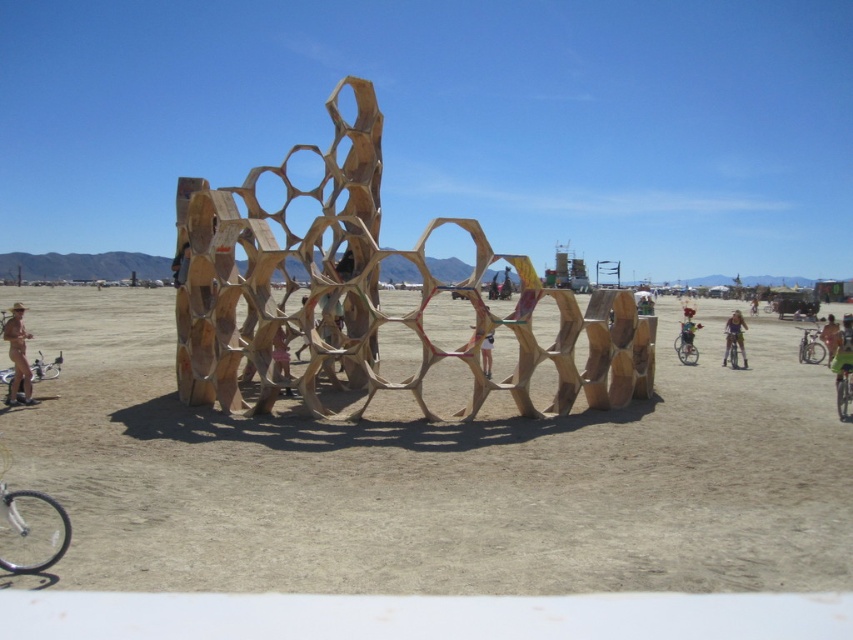
Question: Which object is the closest to the brown textured dirt at center?

Choices:
 (A) metallic silver bicycle at center-right
 (B) white matte wooden sculpture at center

Answer: (B)

Question: Can you confirm if matte gold statue at lower left is wider than green fabric bicycle at center?

Choices:
 (A) no
 (B) yes

Answer: (B)

Question: Among these points, which one is farthest from the camera?

Choices:
 (A) (807, 349)
 (B) (485, 333)
 (C) (824, 339)

Answer: (A)

Question: Is matte gold statue at lower left bigger than silver metallic bicycle at right?

Choices:
 (A) no
 (B) yes

Answer: (A)

Question: Can you confirm if green fabric bicycle at center is thinner than green matte bicycle at center?

Choices:
 (A) yes
 (B) no

Answer: (B)

Question: Which point is closer to the camera taking this photo?

Choices:
 (A) (848, 412)
 (B) (474, 330)
 (C) (480, 392)
 (D) (822, 576)

Answer: (D)